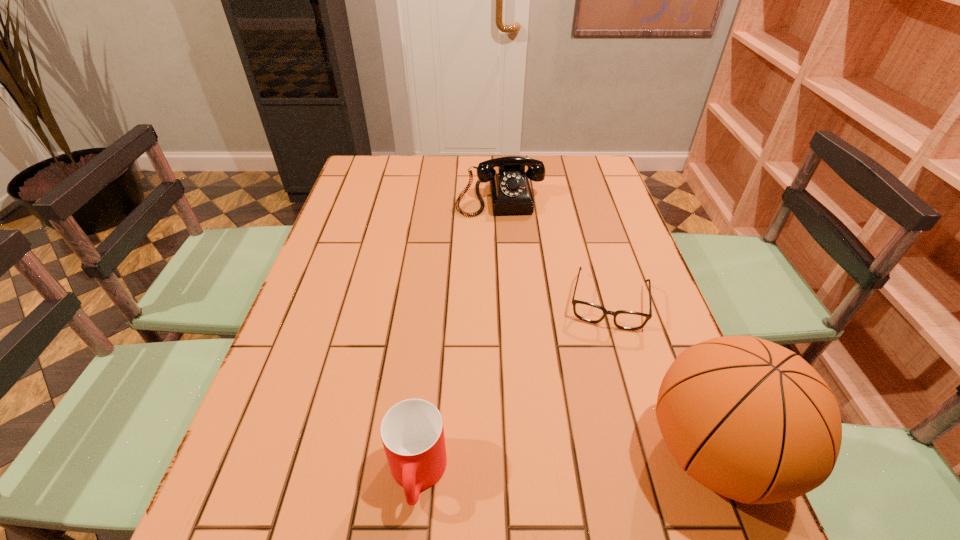
This screenshot has width=960, height=540. What are the coordinates of `vacant area that lies between the third nearest object and the cup` in the screenshot? It's located at (513, 388).

Locate an element on the screen. Image resolution: width=960 pixels, height=540 pixels. free spot between the farthest object and the spectacles is located at coordinates (554, 249).

Identify the location of vacant region between the spectacles and the telephone. (554, 249).

Find the location of a particular element. The width and height of the screenshot is (960, 540). free space between the basketball and the telephone is located at coordinates (607, 325).

At what (x,y) coordinates should I click in order to perform the action: click on object that is the second nearest to the cup. Please return your answer as a coordinate pair (x, y). Image resolution: width=960 pixels, height=540 pixels. Looking at the image, I should click on (627, 320).

At what (x,y) coordinates should I click in order to perform the action: click on object that is the second closest to the third nearest object. Please return your answer as a coordinate pair (x, y). This screenshot has width=960, height=540. Looking at the image, I should click on (510, 192).

Locate an element on the screen. The image size is (960, 540). vacant space that satisfies the following two spatial constraints: 1. on the front side of the third nearest object; 2. on the left side of the farthest object is located at coordinates (506, 301).